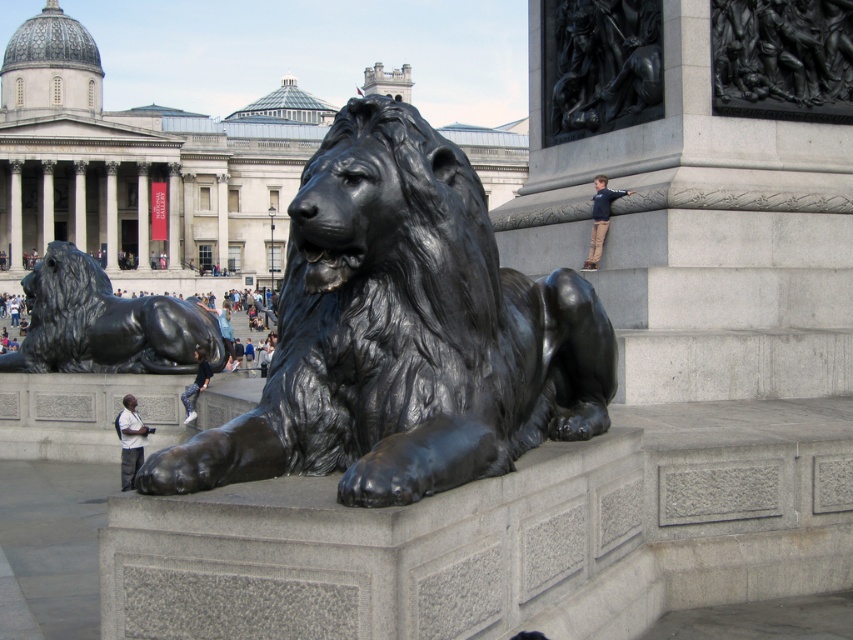
You are standing in front of the black lion statue on the platform. You see a point marked at coordinates [105,323]. What object is located at that point?

The point at coordinates [105,323] indicates the polished bronze lion at lower left.

You are a security guard at the National Gallery. You notice a person wearing a light gray shirt at lower left and denim pants at lower left standing near the black lion statue. According to the museum policy, visitors must maintain a minimum distance of 2 meters between themselves and the statue. Can you determine if the person is compliant with this rule?

The distance between the light gray shirt at lower left and denim pants at lower left is 2.38 meters, which exceeds the required 2 meters. Therefore, the person is compliant with the museum policy.

You are standing in front of the black lion statue on the raised stone platform. You notice a person wearing a light gray shirt at lower left and denim pants at lower left. Which part of their clothing is closer to you?

The light gray shirt at lower left is closer to the viewer than the denim pants at lower left.